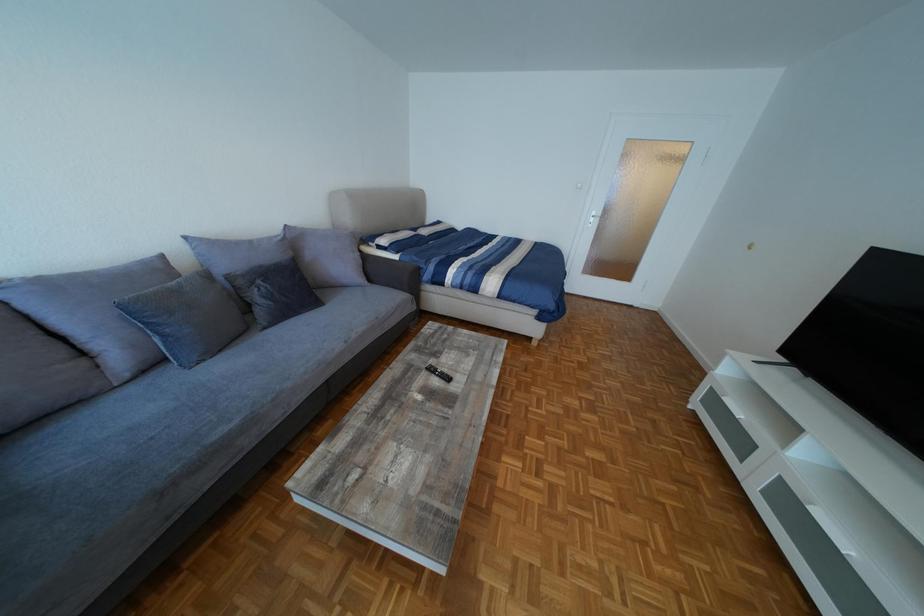
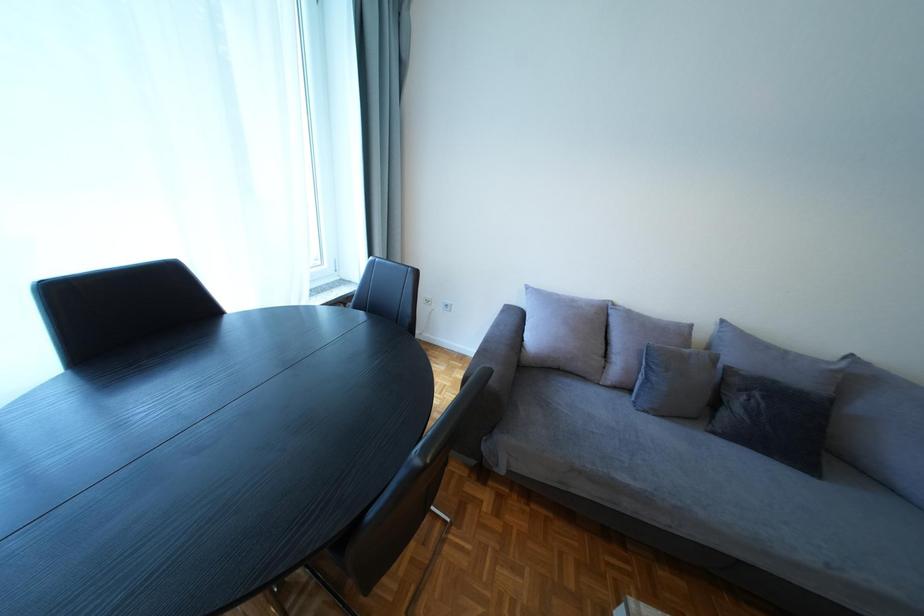
The images are taken continuously from a first-person perspective. In which direction is your viewpoint rotating?

The rotation direction of the camera is left-down.